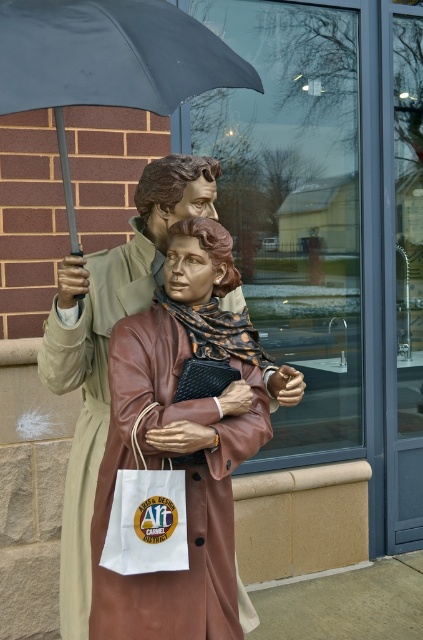
Does matte brown leather coat at center have a greater width compared to matte black umbrella at upper center?

Incorrect, matte brown leather coat at center's width does not surpass matte black umbrella at upper center's.

Does matte brown leather coat at center appear on the left side of matte black umbrella at upper center?

Indeed, matte brown leather coat at center is positioned on the left side of matte black umbrella at upper center.

At what (x,y) coordinates should I click in order to perform the action: click on matte brown leather coat at center. Please return your answer as a coordinate pair (x, y). Looking at the image, I should click on (107, 346).